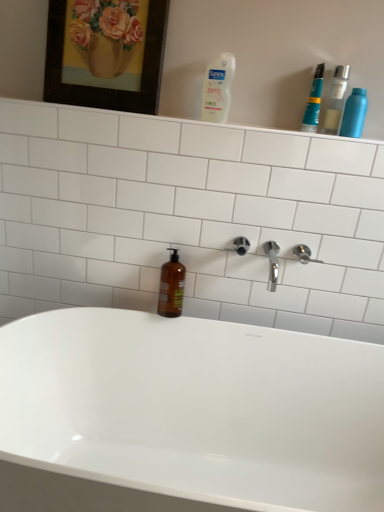
Question: Based on their sizes in the image, would you say satin nickel shower at upper right is bigger or smaller than white glossy shelf at upper center?

Choices:
 (A) big
 (B) small

Answer: (B)

Question: In terms of height, does satin nickel shower at upper right look taller or shorter compared to white glossy shelf at upper center?

Choices:
 (A) short
 (B) tall

Answer: (B)

Question: Which object is the closest to the transparent plastic bottle at upper right, positioned as the second mouthwash in bottom-to-top order?

Choices:
 (A) satin nickel shower at upper right
 (B) white glossy shelf at upper center
 (C) teal plastic toothpaste at upper right, marked as the 1th mouthwash in a top-to-bottom arrangement
 (D) wooden frame at upper left
 (E) white plastic bottle at upper center, which is the 1th cleaning product from left to right

Answer: (C)

Question: Estimate the real-world distances between objects in this image. Which object is closer to the wooden frame at upper left?

Choices:
 (A) white glossy shelf at upper center
 (B) metallic blue spray can at upper right, which is counted as the 1th cleaning product, starting from the right
 (C) brown glass bottle at center, the first mouthwash in the bottom-to-top sequence
 (D) transparent plastic bottle at upper right, positioned as the second mouthwash in bottom-to-top order
 (E) white plastic bottle at upper center, which is the second cleaning product in right-to-left order

Answer: (A)